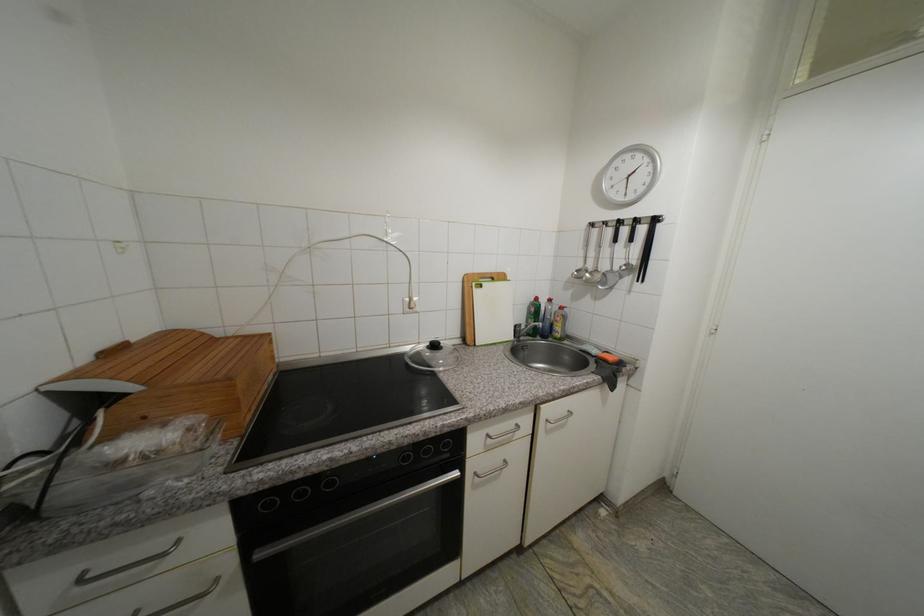
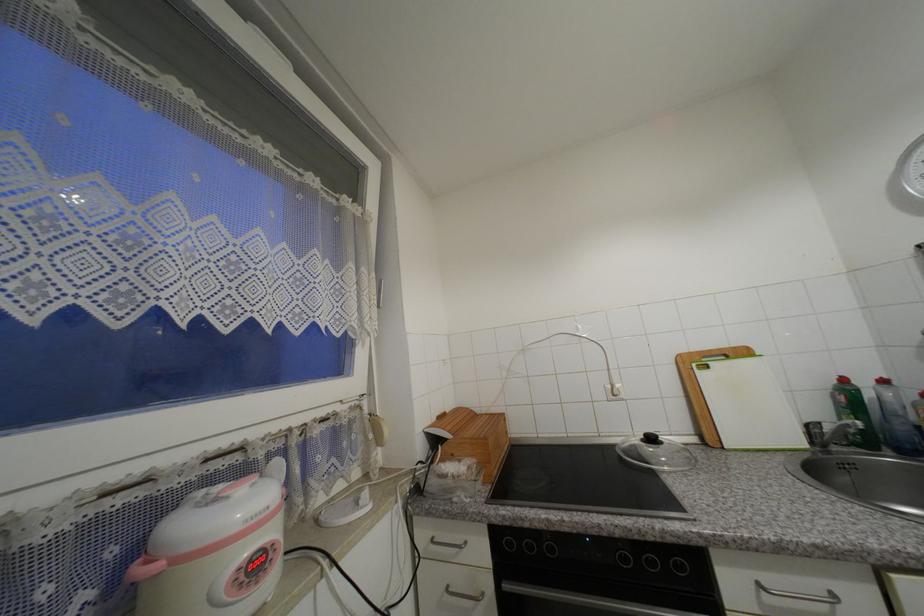
Based on the continuous images, in which direction is the camera rotating?

The camera's rotation is toward left-up.